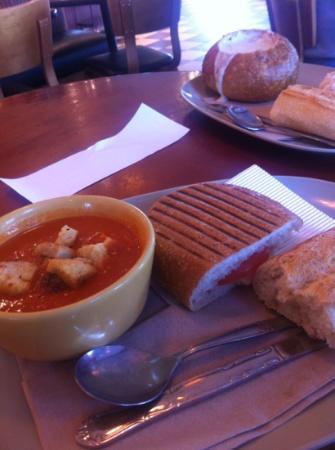
Where is `plates`? plates is located at coordinates (313, 194), (205, 107).